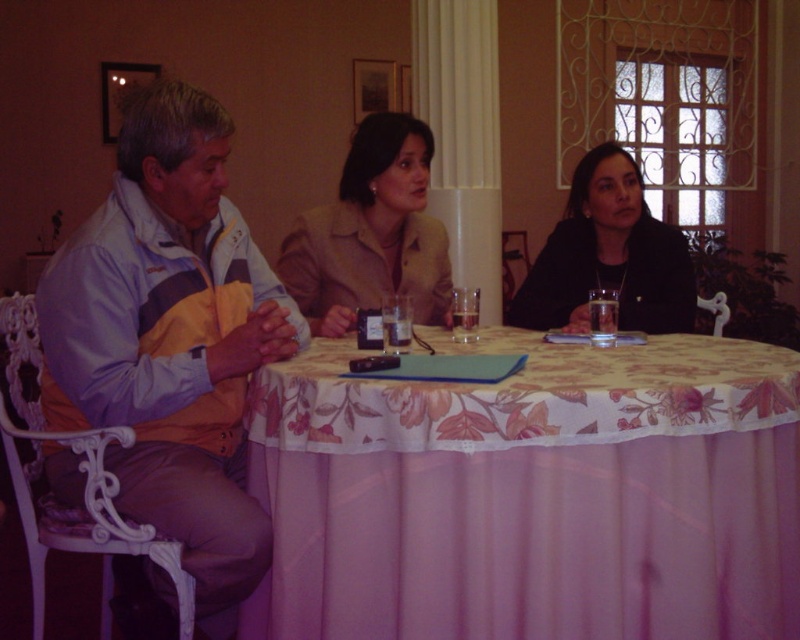
You are standing in the room and want to know where the light blue and yellow jacket at left is located. Can you describe its position relative to the center of the room?

The light blue and yellow jacket at left is located at point 0.528 on the x axis and 0.214 on the y axis, which is to the left and slightly below the center of the room.

You are attending a meeting and need to pass a document to both the person wearing the light blue and yellow jacket at left and the person in the beige fabric jacket at center. Based on their seating positions, which direction should you move to first to reach both efficiently?

The light blue and yellow jacket at left is located below the beige fabric jacket at center, so you should move towards the beige fabric jacket at center first since they are seated higher up and closer to your current position, allowing you to efficiently pass the document to both.

You are standing in the room and want to know the exact location of the beige fabric jacket at center. Can you describe its position relative to the table?

The beige fabric jacket at center is located at point 0.366 on the x axis and 0.465 on the y axis relative to the table.